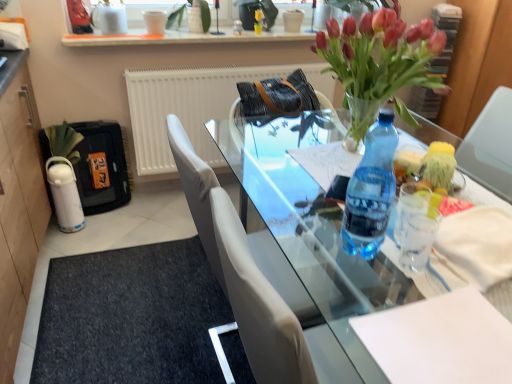
The image size is (512, 384). I want to click on vacant space behind transparent glass cup at center, so click(x=402, y=231).